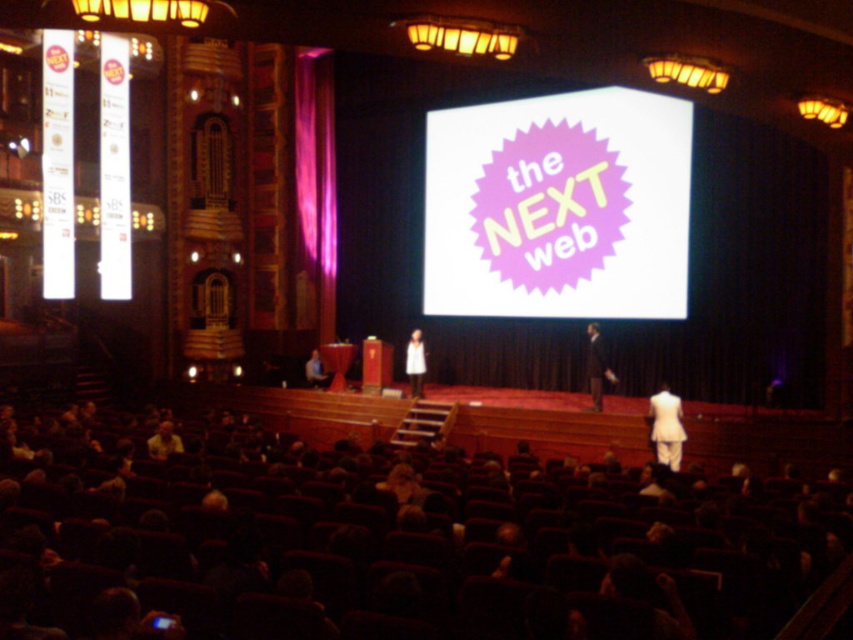
Is white fabric dress at lower right to the right of white fabric at center from the viewer's perspective?

Yes, white fabric dress at lower right is to the right of white fabric at center.

In the scene shown: Between white fabric dress at lower right and white fabric at center, which one has less height?

white fabric dress at lower right is shorter.

Who is more forward, (682, 429) or (410, 371)?

Point (682, 429) is more forward.

Where is `white fabric dress at lower right`? white fabric dress at lower right is located at coordinates (666, 428).

Measure the distance between pink starburst sign at center and camera.

51.19 feet

Which is behind, point (579, 301) or point (148, 452)?

The point (579, 301) is more distant.

This screenshot has height=640, width=853. I want to click on pink starburst sign at center, so click(558, 205).

Where is `pink starburst sign at center`? Image resolution: width=853 pixels, height=640 pixels. pink starburst sign at center is located at coordinates (558, 205).

Does light brown leather jacket at lower left have a greater height compared to light brown leather jacket at lower center?

No.

Can you confirm if light brown leather jacket at lower left is positioned below light brown leather jacket at lower center?

Yes, light brown leather jacket at lower left is below light brown leather jacket at lower center.

Between point (169, 436) and point (309, 362), which one is positioned behind?

Point (309, 362)

Where is `light brown leather jacket at lower left`? The width and height of the screenshot is (853, 640). light brown leather jacket at lower left is located at coordinates (163, 442).